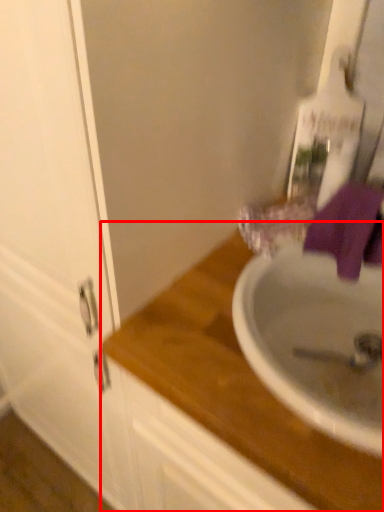
Question: Considering the relative positions of countertop (annotated by the red box) and bath towel in the image provided, where is countertop (annotated by the red box) located with respect to the staircase?

Choices:
 (A) right
 (B) left

Answer: (B)